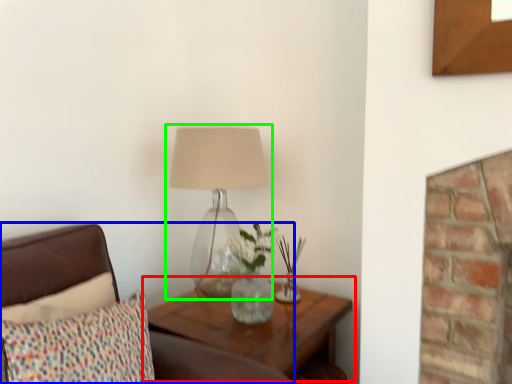
Question: Estimate the real-world distances between objects in this image. Which object is farther from table (highlighted by a red box), furniture (highlighted by a blue box) or lamp (highlighted by a green box)?

Choices:
 (A) furniture
 (B) lamp

Answer: (A)